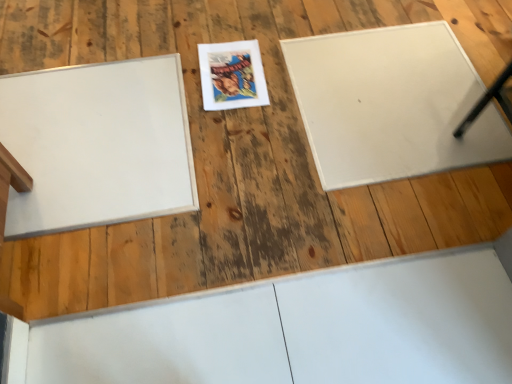
Find the location of a particular element. This screenshot has height=384, width=512. free space in front of matte paper comic book at center is located at coordinates click(231, 135).